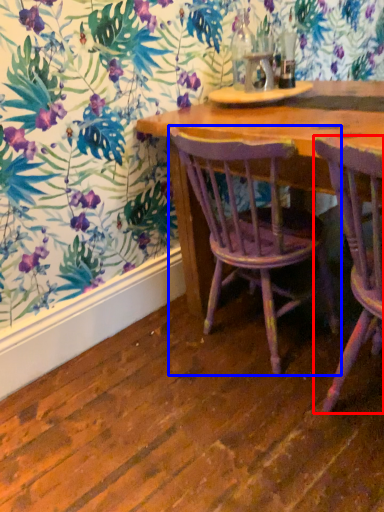
Question: Which point is further to the camera, chair (highlighted by a red box) or chair (highlighted by a blue box)?

Choices:
 (A) chair
 (B) chair

Answer: (B)